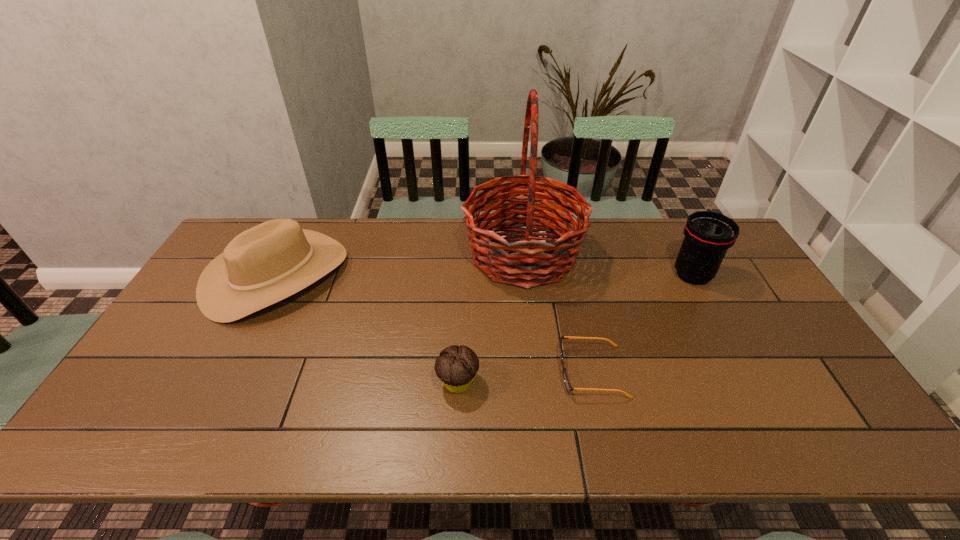
Identify the location of object at the far left corner. (267, 263).

Locate an element on the screen. object that is positioned at the far right corner is located at coordinates (708, 235).

Identify the location of free space at the far edge of the desktop. This screenshot has height=540, width=960. (660, 220).

Locate an element on the screen. free space at the near edge of the desktop is located at coordinates (385, 448).

The height and width of the screenshot is (540, 960). Find the location of `blank space at the right edge`. blank space at the right edge is located at coordinates (780, 380).

You are a GUI agent. You are given a task and a screenshot of the screen. Output one action in this format:
    pyautogui.click(x=<x>, y=<y>)
    Task: Click on the free space between the tallest object and the third tallest object
    
    Given the screenshot: What is the action you would take?
    pyautogui.click(x=400, y=265)

Where is `free space between the basket and the second shortest object`? The width and height of the screenshot is (960, 540). free space between the basket and the second shortest object is located at coordinates (491, 319).

At what (x,y) coordinates should I click in order to perform the action: click on free spot between the basket and the muffin. Please return your answer as a coordinate pair (x, y). The width and height of the screenshot is (960, 540). Looking at the image, I should click on (491, 319).

Locate an element on the screen. This screenshot has height=540, width=960. vacant area that lies between the basket and the shortest object is located at coordinates (558, 313).

You are a GUI agent. You are given a task and a screenshot of the screen. Output one action in this format:
    pyautogui.click(x=<x>, y=<y>)
    Task: Click on the unoccupied position between the rightmost object and the spectacles
    
    Given the screenshot: What is the action you would take?
    pyautogui.click(x=642, y=323)